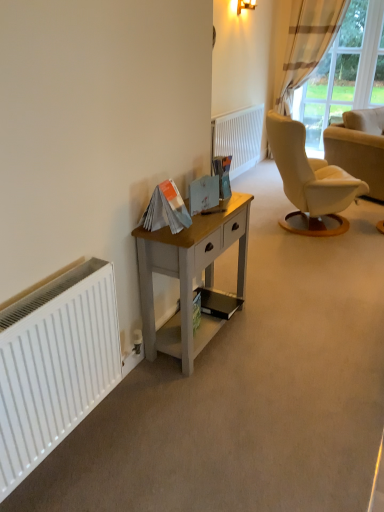
This screenshot has width=384, height=512. Find the location of `vacant area that is situated to the right of light gray wood desk at center`. vacant area that is situated to the right of light gray wood desk at center is located at coordinates (278, 334).